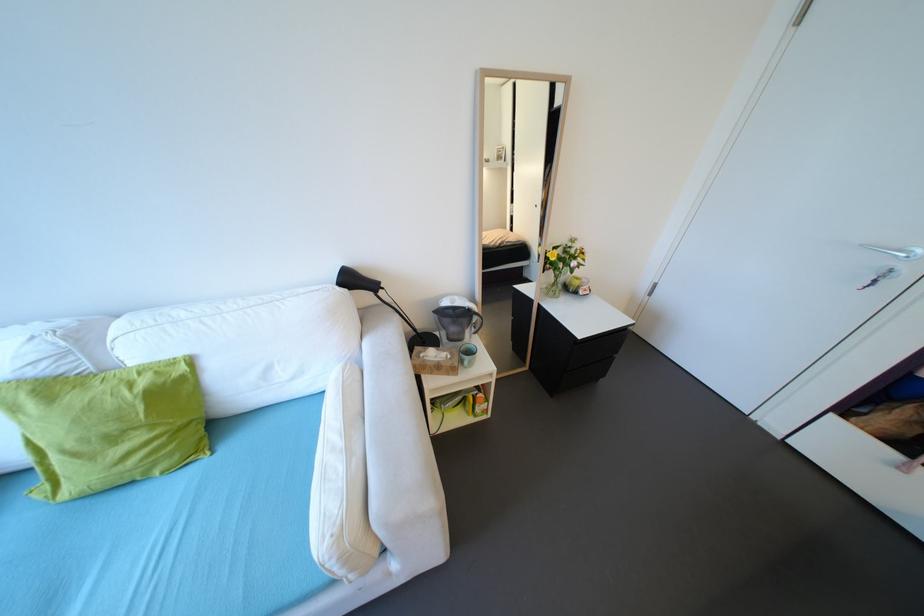
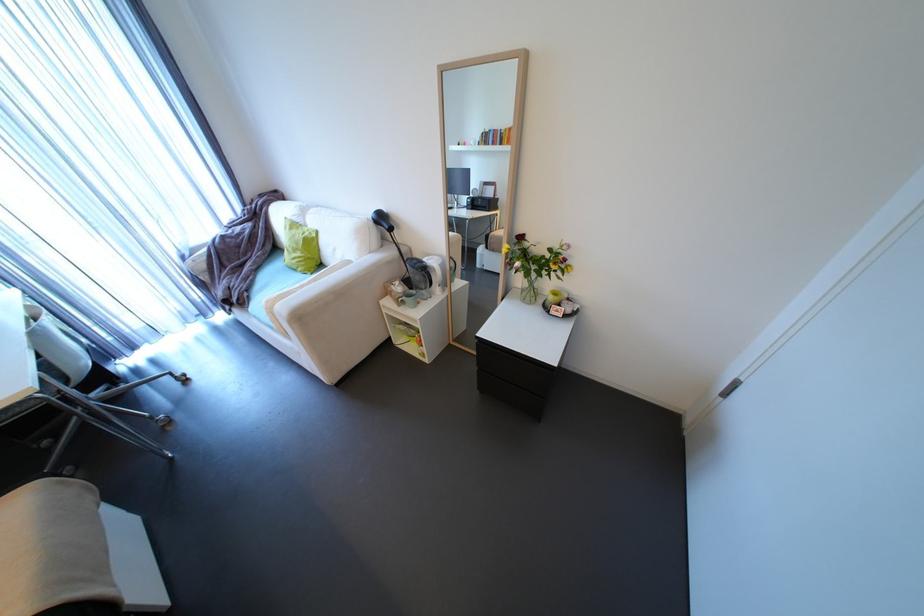
Find the pixel in the second image that matches point (456, 357) in the first image.

(407, 292)